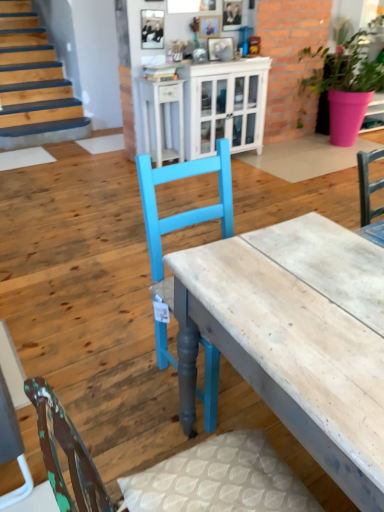
Identify the location of white glossy cabinet at upper center. (162, 118).

Image resolution: width=384 pixels, height=512 pixels. What do you see at coordinates (296, 353) in the screenshot?
I see `wooden desk at center` at bounding box center [296, 353].

Find the location of a particular element. Image resolution: width=384 pixels, height=512 pixels. white glossy cabinet at upper center is located at coordinates (162, 118).

Is pink matte pot at upper right looking in the opposite direction of white glossy cabinet at upper center?

No, pink matte pot at upper right's orientation is not away from white glossy cabinet at upper center.

Is pink matte pot at upper right smaller than white glossy cabinet at upper center?

Actually, pink matte pot at upper right might be larger than white glossy cabinet at upper center.

Locate an element on the screen. Image resolution: width=384 pixels, height=512 pixels. houseplant located above the white glossy cabinet at upper center (from a real-world perspective) is located at coordinates (345, 84).

Is wooden desk at center at the back of pink matte pot at upper right?

That's not correct — pink matte pot at upper right is not looking away from wooden desk at center.

Are pink matte pot at upper right and wooden desk at center making contact?

No, pink matte pot at upper right is not with wooden desk at center.

Would you say pink matte pot at upper right is inside or outside wooden desk at center?

pink matte pot at upper right is outside wooden desk at center.

Does point (340, 81) come in front of point (190, 305)?

That is False.

Relative to white glossy cabinet at upper center, is pink matte pot at upper right in front or behind?

In the image, pink matte pot at upper right appears in front of white glossy cabinet at upper center.

You are a GUI agent. You are given a task and a screenshot of the screen. Output one action in this format:
    pyautogui.click(x=<x>, y=<y>)
    Task: Click on the houseplant on the right of white glossy cabinet at upper center
    The image size is (384, 512).
    Given the screenshot: What is the action you would take?
    pyautogui.click(x=345, y=84)

From the picture: Is pink matte pot at upper right positioned with its back to white glossy cabinet at upper center?

No, pink matte pot at upper right is not facing away from white glossy cabinet at upper center.

From a real-world perspective, relative to white glossy cabinet at upper center, is pink matte pot at upper right vertically above or below?

pink matte pot at upper right is situated higher than white glossy cabinet at upper center in the real world.

The image size is (384, 512). In order to click on table below the white glossy cabinet at upper center (from the image's perspective) in this screenshot , I will do `click(162, 118)`.

Is white glossy cabinet at upper center bigger or smaller than white glossy cabinet at upper center?

Clearly, white glossy cabinet at upper center is smaller in size than white glossy cabinet at upper center.

Does white glossy cabinet at upper center lie behind white glossy cabinet at upper center?

No, it is in front of white glossy cabinet at upper center.

Considering the relative sizes of white glossy cabinet at upper center and wooden desk at center in the image provided, is white glossy cabinet at upper center wider than wooden desk at center?

Incorrect, the width of white glossy cabinet at upper center does not surpass that of wooden desk at center.

Can you confirm if white glossy cabinet at upper center is taller than wooden desk at center?

Yes.

Would you consider white glossy cabinet at upper center to be distant from wooden desk at center?

That's right, there is a large distance between white glossy cabinet at upper center and wooden desk at center.

Is white glossy cabinet at upper center positioned behind wooden desk at center?

Yes, the depth of white glossy cabinet at upper center is greater than that of wooden desk at center.

Considering the relative sizes of white glossy cabinet at upper center and white glossy cabinet at upper center in the image provided, is white glossy cabinet at upper center taller than white glossy cabinet at upper center?

Yes, white glossy cabinet at upper center is taller than white glossy cabinet at upper center.

From a real-world perspective, which is physically below, white glossy cabinet at upper center or white glossy cabinet at upper center?

white glossy cabinet at upper center.

Would you say white glossy cabinet at upper center is outside white glossy cabinet at upper center?

Yes.

Is white glossy cabinet at upper center facing towards pink matte pot at upper right?

No.

Would you say white glossy cabinet at upper center contains pink matte pot at upper right?

No, pink matte pot at upper right is not inside white glossy cabinet at upper center.

Image resolution: width=384 pixels, height=512 pixels. In the image, there is a white glossy cabinet at upper center. What are the coordinates of `houseplant above it (from the image's perspective)` in the screenshot? It's located at 345,84.

The width and height of the screenshot is (384, 512). In order to click on desk below the pink matte pot at upper right (from a real-world perspective) in this screenshot , I will do `click(296, 353)`.

From the image, which object appears to be nearer to wooden desk at center, pink matte pot at upper right or white glossy cabinet at upper center?

white glossy cabinet at upper center is closer to wooden desk at center.

From the image, which object appears to be nearer to white glossy cabinet at upper center, white glossy cabinet at upper center or wooden desk at center?

white glossy cabinet at upper center lies closer to white glossy cabinet at upper center than the other object.

Estimate the real-world distances between objects in this image. Which object is further from pink matte pot at upper right, white glossy cabinet at upper center or white glossy cabinet at upper center?

The object further to pink matte pot at upper right is white glossy cabinet at upper center.

Estimate the real-world distances between objects in this image. Which object is closer to wooden desk at center, white glossy cabinet at upper center or white glossy cabinet at upper center?

white glossy cabinet at upper center is positioned closer to the anchor wooden desk at center.

Estimate the real-world distances between objects in this image. Which object is further from pink matte pot at upper right, wooden desk at center or white glossy cabinet at upper center?

wooden desk at center is positioned further to the anchor pink matte pot at upper right.

Based on their spatial positions, is pink matte pot at upper right or white glossy cabinet at upper center closer to white glossy cabinet at upper center?

Among the two, white glossy cabinet at upper center is located nearer to white glossy cabinet at upper center.

Which object lies further to the anchor point white glossy cabinet at upper center, wooden desk at center or white glossy cabinet at upper center?

wooden desk at center is positioned further to the anchor white glossy cabinet at upper center.

Based on the photo, which object lies nearer to the anchor point white glossy cabinet at upper center, pink matte pot at upper right or wooden desk at center?

pink matte pot at upper right is positioned closer to the anchor white glossy cabinet at upper center.

Locate an element on the screen. This screenshot has height=512, width=384. houseplant located between wooden desk at center and white glossy cabinet at upper center in the depth direction is located at coordinates (345, 84).

The width and height of the screenshot is (384, 512). I want to click on cabinetry situated between white glossy cabinet at upper center and pink matte pot at upper right from left to right, so click(x=205, y=109).

Where is `houseplant located between wooden desk at center and white glossy cabinet at upper center in the depth direction`? houseplant located between wooden desk at center and white glossy cabinet at upper center in the depth direction is located at coordinates (345, 84).

Find the location of a particular element. table between wooden desk at center and white glossy cabinet at upper center from front to back is located at coordinates (162, 118).